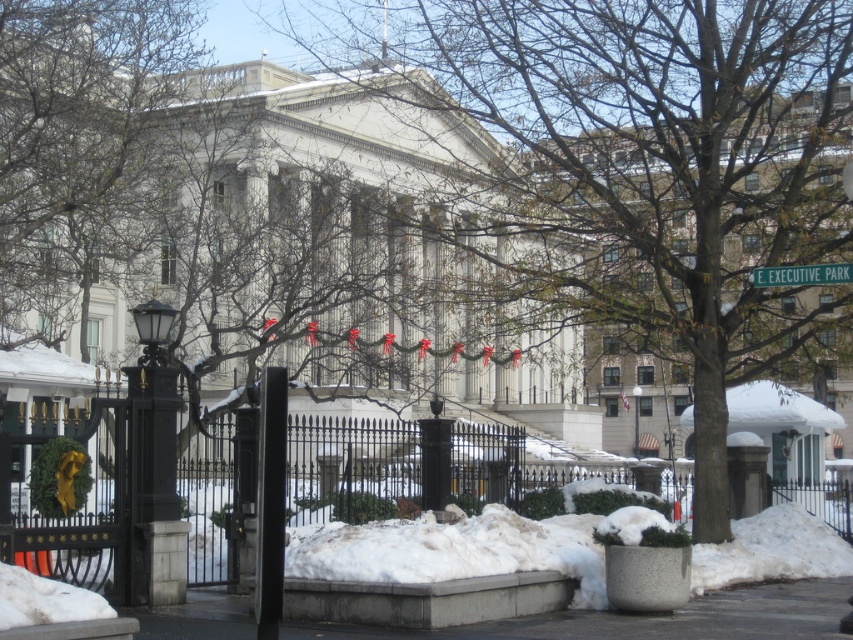
Question: Is gray concrete pavement at lower center further to the viewer compared to green plastic street sign at upper right?

Choices:
 (A) no
 (B) yes

Answer: (A)

Question: Does brown leafless tree at upper center appear on the left side of green plastic street sign at upper right?

Choices:
 (A) yes
 (B) no

Answer: (A)

Question: Which of the following is the closest to the observer?

Choices:
 (A) (247, 630)
 (B) (548, 124)
 (C) (25, 208)

Answer: (A)

Question: Does brown leafy tree at center appear over brown leafless tree at upper center?

Choices:
 (A) no
 (B) yes

Answer: (A)

Question: Which object is closer to the camera taking this photo?

Choices:
 (A) green plastic street sign at upper right
 (B) brown leafless tree at upper center
 (C) gray concrete pavement at lower center
 (D) black glossy pole at center

Answer: (D)

Question: Which is farther from the brown leafy tree at center?

Choices:
 (A) green plastic street sign at upper right
 (B) black glossy pole at center
 (C) brown leafless tree at upper center

Answer: (B)